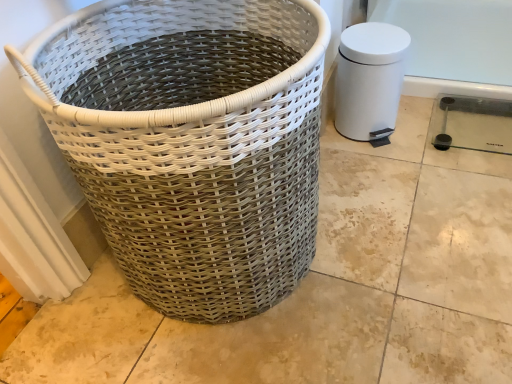
Question: Is white matte water heater at right at the back of white woven basket at left?

Choices:
 (A) yes
 (B) no

Answer: (B)

Question: Does white woven basket at left contain white matte water heater at right?

Choices:
 (A) no
 (B) yes

Answer: (A)

Question: Can you confirm if white woven basket at left is thinner than white matte water heater at right?

Choices:
 (A) no
 (B) yes

Answer: (A)

Question: Can you confirm if white woven basket at left is positioned to the right of white matte water heater at right?

Choices:
 (A) yes
 (B) no

Answer: (B)

Question: Can you confirm if white woven basket at left is smaller than white matte water heater at right?

Choices:
 (A) yes
 (B) no

Answer: (B)

Question: Considering the relative sizes of white woven basket at left and white matte water heater at right in the image provided, is white woven basket at left taller than white matte water heater at right?

Choices:
 (A) no
 (B) yes

Answer: (B)

Question: Considering the relative sizes of white matte water heater at right and white woven basket at left in the image provided, is white matte water heater at right thinner than white woven basket at left?

Choices:
 (A) no
 (B) yes

Answer: (B)

Question: Is white matte water heater at right wider than white woven basket at left?

Choices:
 (A) yes
 (B) no

Answer: (B)

Question: Considering the relative positions of white matte water heater at right and white woven basket at left in the image provided, is white matte water heater at right in front of white woven basket at left?

Choices:
 (A) no
 (B) yes

Answer: (A)

Question: From the image's perspective, is white matte water heater at right located beneath white woven basket at left?

Choices:
 (A) no
 (B) yes

Answer: (A)

Question: From the image's perspective, is white matte water heater at right on white woven basket at left?

Choices:
 (A) yes
 (B) no

Answer: (A)

Question: Is white matte water heater at right facing towards white woven basket at left?

Choices:
 (A) no
 (B) yes

Answer: (A)

Question: Is white matte water heater at right in front of or behind white woven basket at left in the image?

Choices:
 (A) front
 (B) behind

Answer: (B)